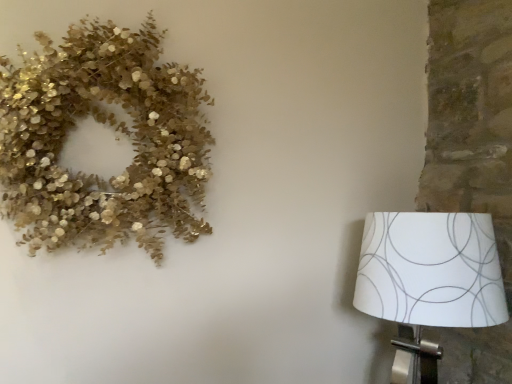
Question: Is point (14, 110) closer or farther from the camera than point (496, 281)?

Choices:
 (A) farther
 (B) closer

Answer: (B)

Question: Is gold glittery wreath at upper left spatially inside white paper lampshade at right, or outside of it?

Choices:
 (A) inside
 (B) outside

Answer: (B)

Question: In the image, is gold glittery wreath at upper left on the left side or the right side of white paper lampshade at right?

Choices:
 (A) left
 (B) right

Answer: (A)

Question: Is white paper lampshade at right taller or shorter than gold glittery wreath at upper left?

Choices:
 (A) short
 (B) tall

Answer: (A)

Question: Considering the relative positions of white paper lampshade at right and gold glittery wreath at upper left in the image provided, is white paper lampshade at right to the left or to the right of gold glittery wreath at upper left?

Choices:
 (A) left
 (B) right

Answer: (B)

Question: Is white paper lampshade at right bigger or smaller than gold glittery wreath at upper left?

Choices:
 (A) small
 (B) big

Answer: (B)

Question: Is white paper lampshade at right in front of or behind gold glittery wreath at upper left in the image?

Choices:
 (A) front
 (B) behind

Answer: (B)